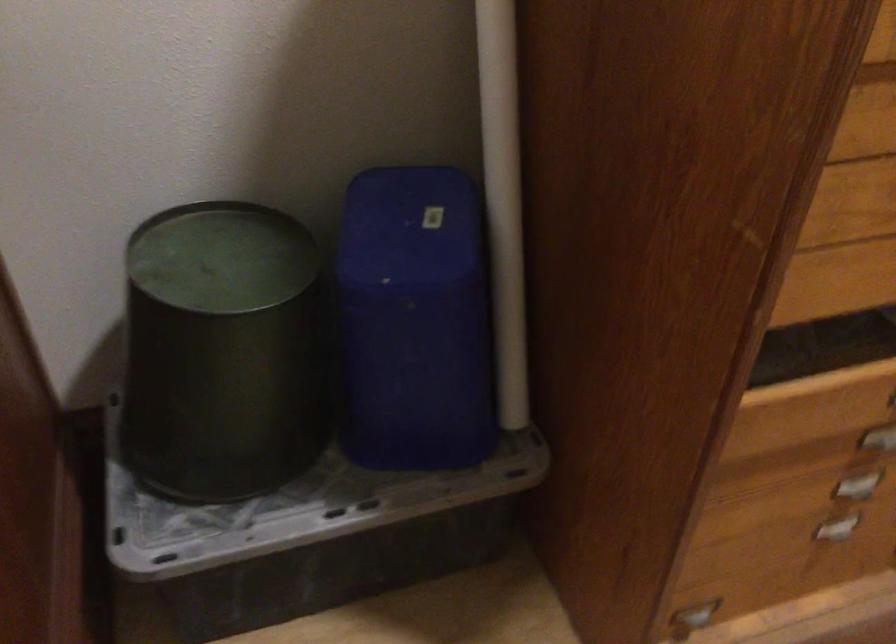
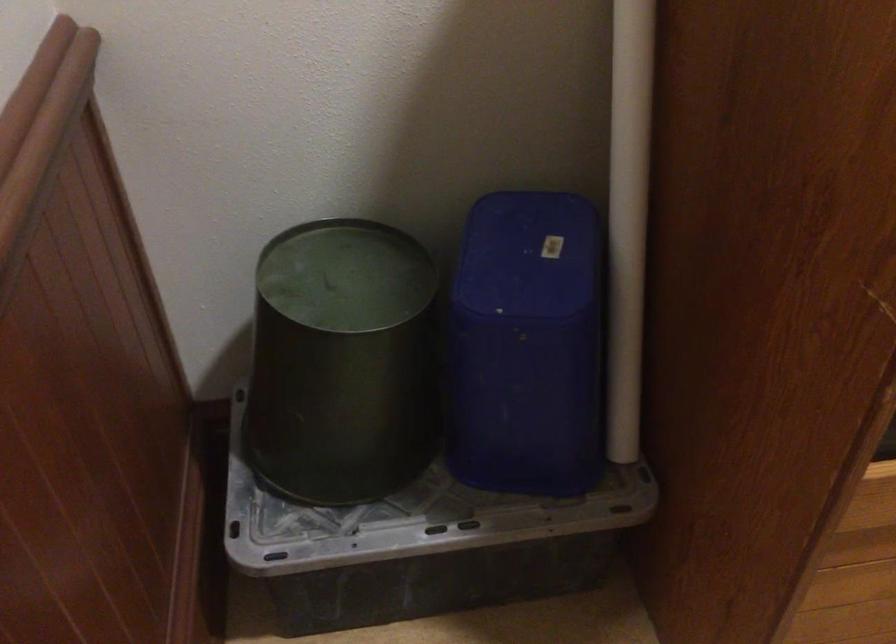
Question: Based on the continuous images, in which direction is the camera rotating? Reply with the corresponding letter.

Choices:
 (A) Left
 (B) Right
 (C) Up
 (D) Down

Answer: (A)